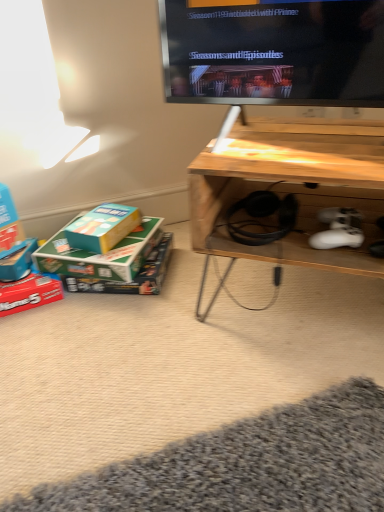
You are a GUI agent. You are given a task and a screenshot of the screen. Output one action in this format:
    pyautogui.click(x=<x>, y=<y>)
    Task: Click on the vacant area that lies in front of matte red box at lower left, the 2th box in the left-to-right sequence
    The width and height of the screenshot is (384, 512).
    Given the screenshot: What is the action you would take?
    [33, 335]